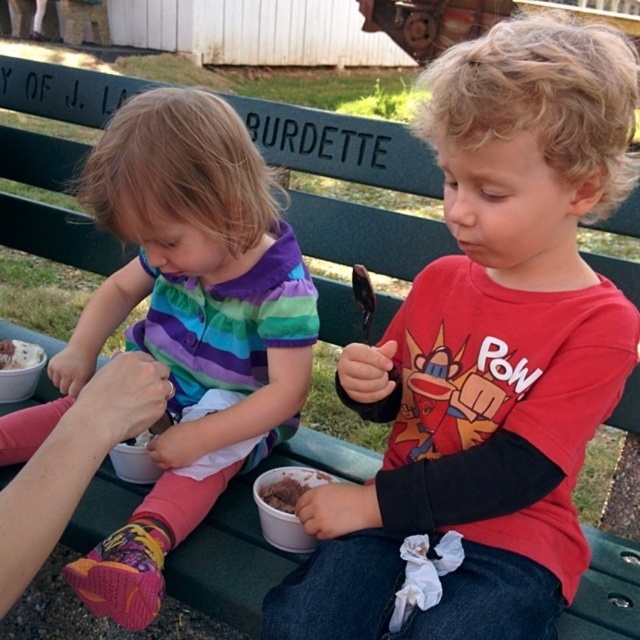
Question: Considering the relative positions of chocolate ice cream at lower center and white matte ice cream at lower left in the image provided, where is chocolate ice cream at lower center located with respect to white matte ice cream at lower left?

Choices:
 (A) above
 (B) below

Answer: (B)

Question: Which point appears farthest from the camera in this image?

Choices:
 (A) (305, 612)
 (B) (291, 490)

Answer: (B)

Question: Is matte red shirt at center thinner than chocolate ice cream at lower center?

Choices:
 (A) no
 (B) yes

Answer: (A)

Question: Estimate the real-world distances between objects in this image. Which object is closer to the matte red shirt at center?

Choices:
 (A) multicolored striped shirt at center
 (B) white matte ice cream at lower left

Answer: (A)

Question: Among these points, which one is nearest to the camera?

Choices:
 (A) (451, 484)
 (B) (220, 294)
 (C) (10, 368)

Answer: (A)

Question: From the image, what is the correct spatial relationship of matte red shirt at center in relation to white matte ice cream at lower left?

Choices:
 (A) right
 (B) left

Answer: (A)